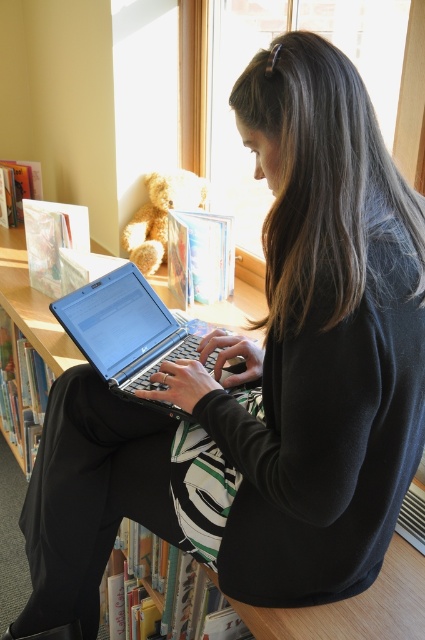
You are a student who wants to place a new book on the wooden bookcase at center. However, there is a satin black laptop at center in the way. Can you easily access the bookcase?

The satin black laptop at center is behind wooden bookcase at center, so the laptop is not blocking the front of the bookcase. You can easily access the wooden bookcase at center.

You are standing in the library and need to locate the wooden bookcase at center. According to the coordinates provided, where exactly is it positioned?

The wooden bookcase at center is positioned at coordinates point (25,349).